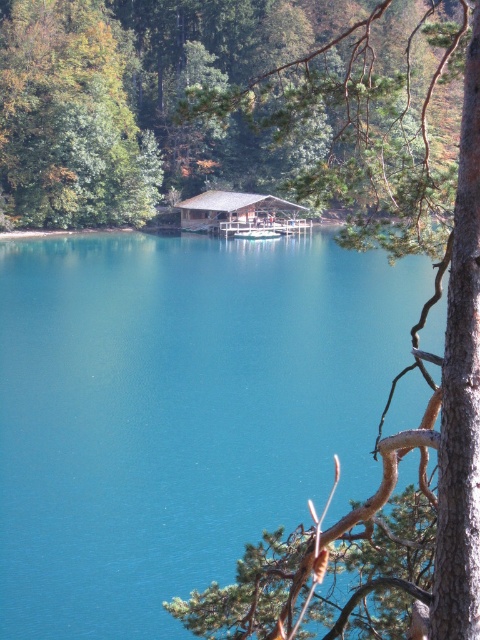
Question: Which object is the farthest from the green leafy tree at upper left?

Choices:
 (A) teal glossy water at center
 (B) green pine branch at upper center

Answer: (B)

Question: Is green pine branch at upper center positioned in front of brown wooden hut at center?

Choices:
 (A) yes
 (B) no

Answer: (A)

Question: Based on their relative distances, which object is farther from the brown wooden hut at center?

Choices:
 (A) green pine branch at upper center
 (B) teal glossy water at center
 (C) green leafy tree at upper left

Answer: (A)

Question: Among these points, which one is farthest from the camera?

Choices:
 (A) (76, 525)
 (B) (291, 209)
 (C) (368, 536)
 (D) (22, 193)

Answer: (B)

Question: Is teal glossy water at center in front of green leafy tree at upper left?

Choices:
 (A) no
 (B) yes

Answer: (B)

Question: In this image, where is green pine branch at upper center located relative to brown wooden hut at center?

Choices:
 (A) below
 (B) above

Answer: (B)